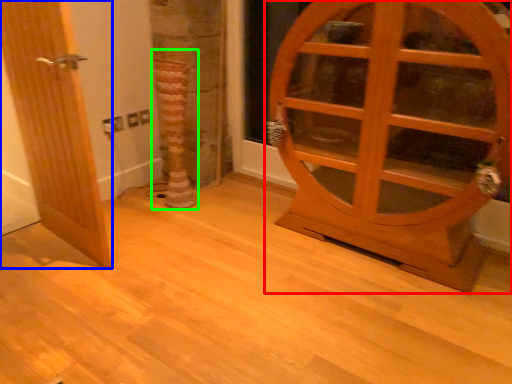
Question: Which is nearer to the door (highlighted by a red box)? door (highlighted by a blue box) or tree trunk (highlighted by a green box).

Choices:
 (A) door
 (B) tree trunk

Answer: (B)